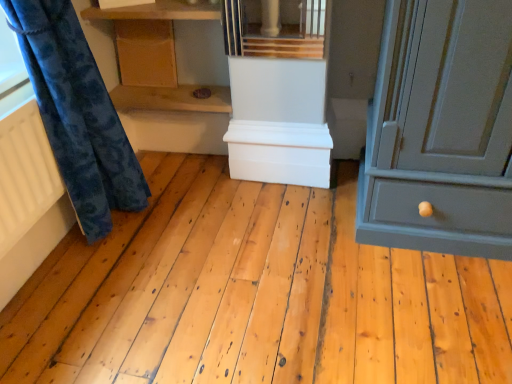
Locate an element on the screen. This screenshot has height=384, width=512. wooden cabinet at upper center, placed as the first cabinetry when sorted from top to bottom is located at coordinates (146, 52).

Find the location of a particular element. This screenshot has width=512, height=384. white matte chest at center, which ranks as the first cabinetry in right-to-left order is located at coordinates (279, 152).

Is wooden shelf at upper center, acting as the first shelf starting from the top, in front of or behind wooden cabinet at upper center, arranged as the first cabinetry when viewed from the left, in the image?

wooden shelf at upper center, acting as the first shelf starting from the top, is positioned closer to the viewer than wooden cabinet at upper center, arranged as the first cabinetry when viewed from the left.

From a real-world perspective, between wooden shelf at upper center, which appears as the second shelf when ordered from the bottom, and wooden cabinet at upper center, arranged as the first cabinetry when viewed from the left, who is vertically higher?

wooden shelf at upper center, which appears as the second shelf when ordered from the bottom.

Does wooden shelf at upper center, which appears as the second shelf when ordered from the bottom, have a greater height compared to wooden cabinet at upper center, arranged as the first cabinetry when viewed from the left?

No.

Is point (122, 19) positioned before point (166, 74)?

Yes.

Is white matte chest at center, which is the 2th cabinetry in left-to-right order, inside or outside of matte gray cabinet at right?

white matte chest at center, which is the 2th cabinetry in left-to-right order, exists outside the volume of matte gray cabinet at right.

Is white matte chest at center, which is the 2th cabinetry in left-to-right order, far from matte gray cabinet at right?

No, white matte chest at center, which is the 2th cabinetry in left-to-right order, is not far from matte gray cabinet at right.

Does white matte chest at center, which is the 2th cabinetry in left-to-right order, have a larger size compared to matte gray cabinet at right?

Incorrect, white matte chest at center, which is the 2th cabinetry in left-to-right order, is not larger than matte gray cabinet at right.

Considering the sizes of objects white matte chest at center, arranged as the second cabinetry when viewed from the top, and matte gray cabinet at right in the image provided, who is thinner, white matte chest at center, arranged as the second cabinetry when viewed from the top, or matte gray cabinet at right?

white matte chest at center, arranged as the second cabinetry when viewed from the top, is thinner.

Which of these two, velvety blue curtain at left or matte gray cabinet at right, is smaller?

With smaller size is velvety blue curtain at left.

Can we say velvety blue curtain at left lies outside matte gray cabinet at right?

Yes, velvety blue curtain at left is not within matte gray cabinet at right.

Looking at this image, from a real-world perspective, which is physically above, velvety blue curtain at left or matte gray cabinet at right?

velvety blue curtain at left.

Visually, is velvety blue curtain at left positioned to the left or to the right of matte gray cabinet at right?

From the image, it's evident that velvety blue curtain at left is to the left of matte gray cabinet at right.

Is white matte radiator at left not within wooden shelf at center, the second shelf positioned from the top?

white matte radiator at left lies outside wooden shelf at center, the second shelf positioned from the top,'s area.

Who is bigger, white matte radiator at left or wooden shelf at center, which is counted as the 1th shelf, starting from the bottom?

Bigger between the two is wooden shelf at center, which is counted as the 1th shelf, starting from the bottom.

Is the position of white matte radiator at left less distant than that of wooden shelf at center, which is counted as the 1th shelf, starting from the bottom?

Yes, white matte radiator at left is closer to the camera.

From a real-world perspective, who is located higher, white matte radiator at left or wooden shelf at center, which is counted as the 1th shelf, starting from the bottom?

In real-world perspective, white matte radiator at left is above.

Is wooden cabinet at upper center, placed as the first cabinetry when sorted from top to bottom, at the left side of wooden shelf at upper center, acting as the first shelf starting from the top?

Yes, wooden cabinet at upper center, placed as the first cabinetry when sorted from top to bottom, is to the left of wooden shelf at upper center, acting as the first shelf starting from the top.

Considering the sizes of wooden cabinet at upper center, arranged as the first cabinetry when viewed from the left, and wooden shelf at upper center, which appears as the second shelf when ordered from the bottom, in the image, is wooden cabinet at upper center, arranged as the first cabinetry when viewed from the left, bigger or smaller than wooden shelf at upper center, which appears as the second shelf when ordered from the bottom,?

Clearly, wooden cabinet at upper center, arranged as the first cabinetry when viewed from the left, is smaller in size than wooden shelf at upper center, which appears as the second shelf when ordered from the bottom.

Is point (170, 54) positioned in front of point (202, 3)?

No.

Does wooden cabinet at upper center, which is the 2th cabinetry in bottom-to-top order, turn towards wooden shelf at upper center, which appears as the second shelf when ordered from the bottom?

No, wooden cabinet at upper center, which is the 2th cabinetry in bottom-to-top order, is not facing towards wooden shelf at upper center, which appears as the second shelf when ordered from the bottom.

Can you tell me how much wooden shelf at upper center, acting as the first shelf starting from the top, and wooden shelf at center, the second shelf positioned from the top, differ in facing direction?

0.000299 degrees separate the facing orientations of wooden shelf at upper center, acting as the first shelf starting from the top, and wooden shelf at center, the second shelf positioned from the top.

Who is taller, wooden shelf at upper center, acting as the first shelf starting from the top, or wooden shelf at center, which is counted as the 1th shelf, starting from the bottom?

wooden shelf at upper center, acting as the first shelf starting from the top.

You are a GUI agent. You are given a task and a screenshot of the screen. Output one action in this format:
    pyautogui.click(x=<x>, y=<y>)
    Task: Click on the shelf that is under the wooden shelf at upper center, acting as the first shelf starting from the top (from a real-world perspective)
    This screenshot has height=384, width=512.
    Given the screenshot: What is the action you would take?
    pyautogui.click(x=170, y=99)

Is wooden shelf at upper center, acting as the first shelf starting from the top, spatially inside wooden shelf at center, which is counted as the 1th shelf, starting from the bottom, or outside of it?

wooden shelf at upper center, acting as the first shelf starting from the top, is located beyond the bounds of wooden shelf at center, which is counted as the 1th shelf, starting from the bottom.

Which is in front, point (16, 157) or point (280, 173)?

The point (16, 157) is more forward.

Is white matte radiator at left to the left or to the right of white matte chest at center, arranged as the second cabinetry when viewed from the top, in the image?

From the image, it's evident that white matte radiator at left is to the left of white matte chest at center, arranged as the second cabinetry when viewed from the top.

Considering the relative sizes of white matte radiator at left and white matte chest at center, arranged as the second cabinetry when viewed from the top, in the image provided, is white matte radiator at left taller than white matte chest at center, arranged as the second cabinetry when viewed from the top,?

Indeed, white matte radiator at left has a greater height compared to white matte chest at center, arranged as the second cabinetry when viewed from the top.

Identify the location of shelf that appears above the wooden cabinet at upper center, placed as the first cabinetry when sorted from top to bottom (from a real-world perspective). This screenshot has width=512, height=384. (x=157, y=11).

At what (x,y) coordinates should I click in order to perform the action: click on the 1st cabinetry behind the matte gray cabinet at right. Please return your answer as a coordinate pair (x, y). The width and height of the screenshot is (512, 384). Looking at the image, I should click on (279, 152).

Based on their spatial positions, is wooden shelf at upper center, which appears as the second shelf when ordered from the bottom, or matte gray cabinet at right further from wooden cabinet at upper center, which is the 2th cabinetry in bottom-to-top order?

matte gray cabinet at right lies further to wooden cabinet at upper center, which is the 2th cabinetry in bottom-to-top order, than the other object.

Estimate the real-world distances between objects in this image. Which object is further from matte gray cabinet at right, wooden cabinet at upper center, arranged as the first cabinetry when viewed from the left, or wooden shelf at center, which is counted as the 1th shelf, starting from the bottom?

The object further to matte gray cabinet at right is wooden cabinet at upper center, arranged as the first cabinetry when viewed from the left.

When comparing their distances from matte gray cabinet at right, does velvety blue curtain at left or wooden cabinet at upper center, which is the 2th cabinetry in bottom-to-top order, seem further?

Based on the image, wooden cabinet at upper center, which is the 2th cabinetry in bottom-to-top order, appears to be further to matte gray cabinet at right.

When comparing their distances from velvety blue curtain at left, does white matte radiator at left or wooden shelf at upper center, which appears as the second shelf when ordered from the bottom, seem further?

Based on the image, wooden shelf at upper center, which appears as the second shelf when ordered from the bottom, appears to be further to velvety blue curtain at left.

Which object lies further to the anchor point white matte chest at center, arranged as the second cabinetry when viewed from the top, white matte radiator at left or matte gray cabinet at right?

white matte radiator at left lies further to white matte chest at center, arranged as the second cabinetry when viewed from the top, than the other object.

Looking at the image, which one is located further to wooden cabinet at upper center, the 2th cabinetry viewed from the right, white matte radiator at left or wooden shelf at center, which is counted as the 1th shelf, starting from the bottom?

Based on the image, white matte radiator at left appears to be further to wooden cabinet at upper center, the 2th cabinetry viewed from the right.

Which object lies nearer to the anchor point white matte chest at center, which is the 2th cabinetry in left-to-right order, velvety blue curtain at left or wooden cabinet at upper center, the 2th cabinetry viewed from the right?

Based on the image, wooden cabinet at upper center, the 2th cabinetry viewed from the right, appears to be nearer to white matte chest at center, which is the 2th cabinetry in left-to-right order.

In the scene shown: From the image, which object appears to be nearer to wooden shelf at center, which is counted as the 1th shelf, starting from the bottom, matte gray cabinet at right or wooden cabinet at upper center, arranged as the first cabinetry when viewed from the left?

Among the two, wooden cabinet at upper center, arranged as the first cabinetry when viewed from the left, is located nearer to wooden shelf at center, which is counted as the 1th shelf, starting from the bottom.

Where is `shelf positioned between white matte radiator at left and wooden cabinet at upper center, arranged as the first cabinetry when viewed from the left, from near to far`? shelf positioned between white matte radiator at left and wooden cabinet at upper center, arranged as the first cabinetry when viewed from the left, from near to far is located at coordinates (157, 11).

At what (x,y) coordinates should I click in order to perform the action: click on cabinetry located between wooden shelf at center, which is counted as the 1th shelf, starting from the bottom, and matte gray cabinet at right in the left-right direction. Please return your answer as a coordinate pair (x, y). The image size is (512, 384). Looking at the image, I should click on (279, 152).

This screenshot has width=512, height=384. I want to click on curtain that lies between wooden shelf at upper center, acting as the first shelf starting from the top, and white matte radiator at left from top to bottom, so click(77, 114).

Locate an element on the screen. This screenshot has height=384, width=512. cabinetry between wooden shelf at upper center, acting as the first shelf starting from the top, and wooden shelf at center, which is counted as the 1th shelf, starting from the bottom, vertically is located at coordinates (146, 52).